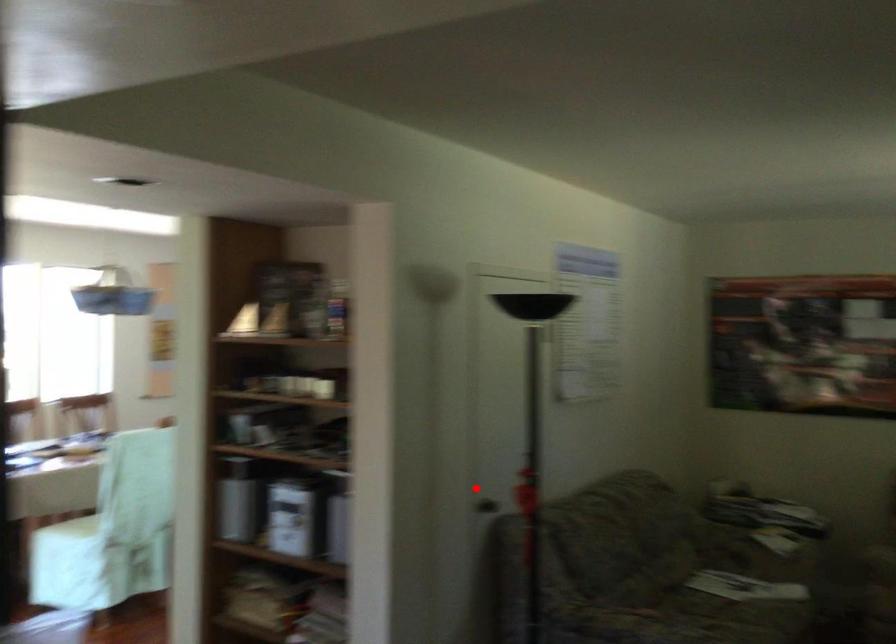
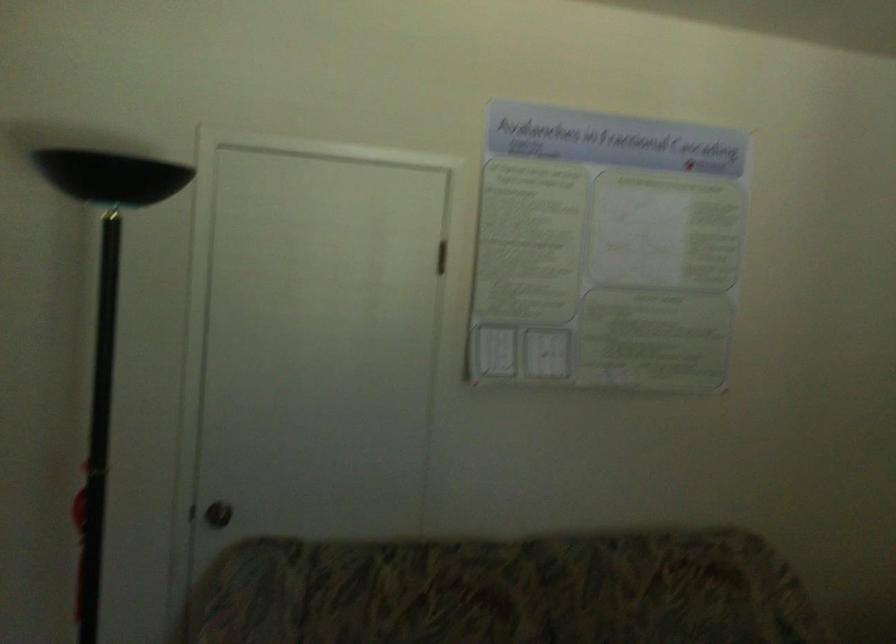
Where in the second image is the point corresponding to the highlighted location from the first image?

(218, 514)